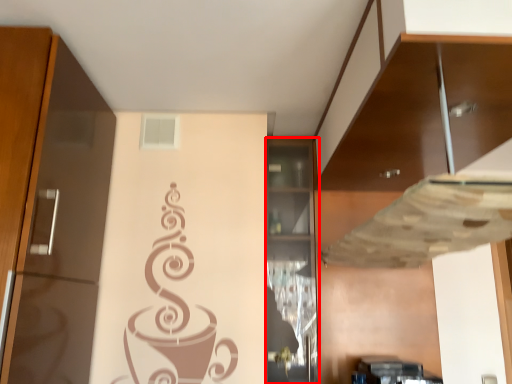
Question: Observing the image, what is the correct spatial positioning of cabinetry (annotated by the red box) in reference to cabinetry?

Choices:
 (A) left
 (B) right

Answer: (A)